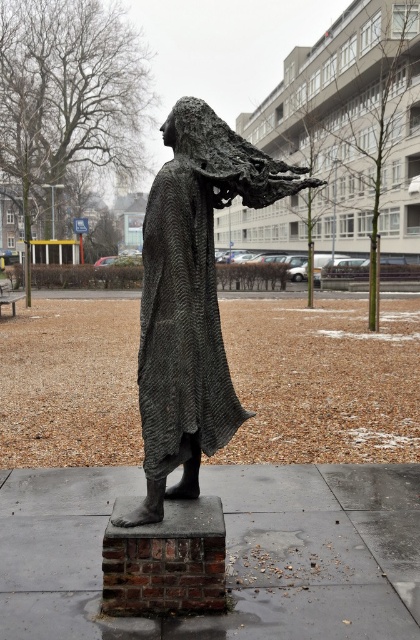
Question: Can you confirm if bronze textured statue at center is positioned to the left of textured dark gray robe at center?

Choices:
 (A) yes
 (B) no

Answer: (B)

Question: Which of the following is the farthest from the observer?

Choices:
 (A) (147, 198)
 (B) (196, 314)

Answer: (A)

Question: Is bronze textured statue at center thinner than textured dark gray robe at center?

Choices:
 (A) yes
 (B) no

Answer: (B)

Question: Can you confirm if bronze textured statue at center is positioned above textured dark gray robe at center?

Choices:
 (A) yes
 (B) no

Answer: (A)